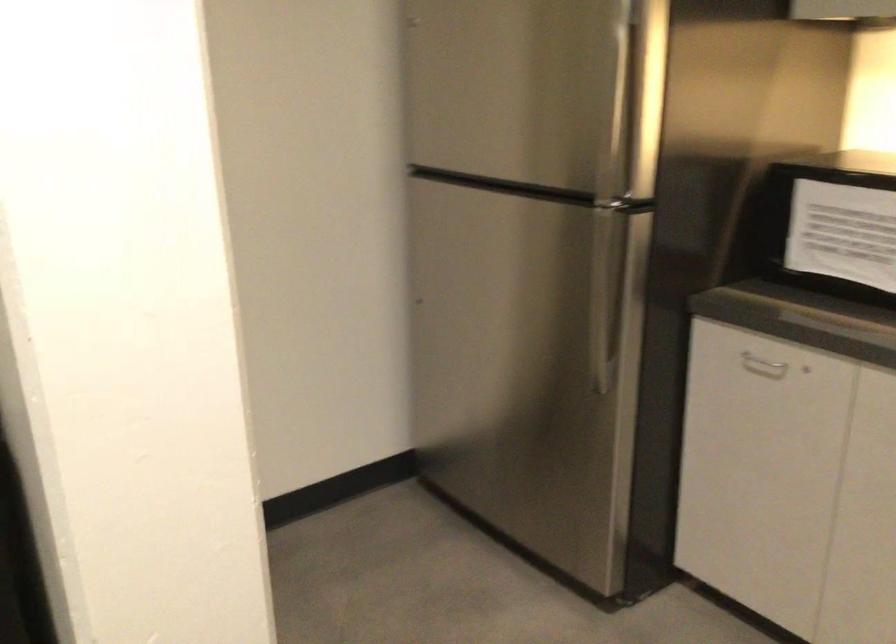
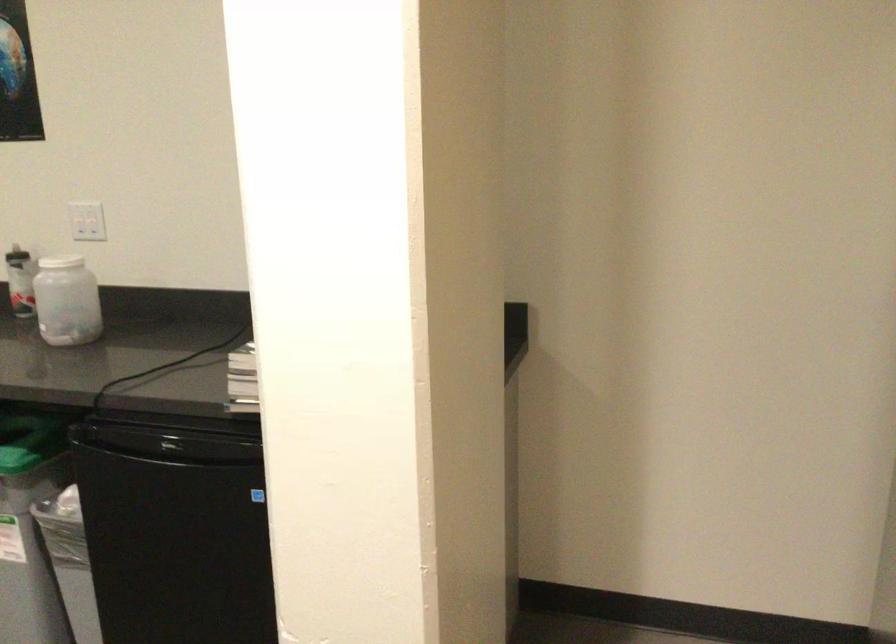
Question: The first image is from the beginning of the video and the second image is from the end. How did the camera likely rotate when shooting the video?

Choices:
 (A) Left
 (B) Right
 (C) Up
 (D) Down

Answer: (A)